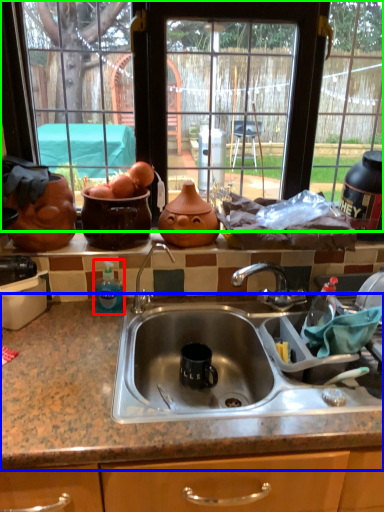
Question: Which is nearer to the bottle (highlighted by a red box)? countertop (highlighted by a blue box) or window (highlighted by a green box).

Choices:
 (A) countertop
 (B) window

Answer: (A)